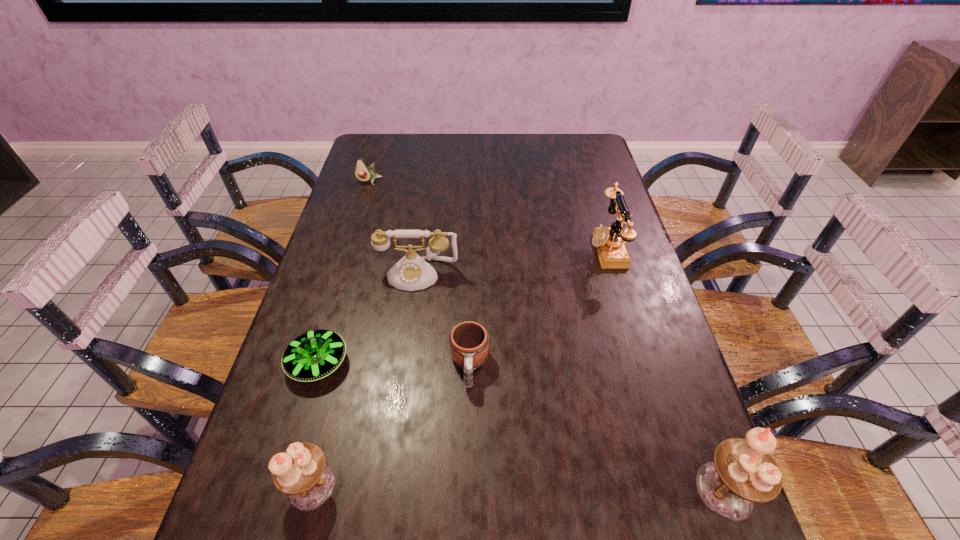
Locate an element on the screen. The height and width of the screenshot is (540, 960). saucer that is at the left edge is located at coordinates (315, 354).

The height and width of the screenshot is (540, 960). Find the location of `candle holder present at the right edge`. candle holder present at the right edge is located at coordinates (743, 472).

The image size is (960, 540). What are the coordinates of `telephone at the right edge` in the screenshot? It's located at (609, 241).

Find the location of a particular element. Image resolution: width=960 pixels, height=540 pixels. object located at the near left corner is located at coordinates click(x=301, y=472).

Image resolution: width=960 pixels, height=540 pixels. Identify the location of object that is at the near right corner. (743, 472).

The height and width of the screenshot is (540, 960). In the image, there is a desktop. Find the location of `vacant space at the far edge`. vacant space at the far edge is located at coordinates (439, 137).

Image resolution: width=960 pixels, height=540 pixels. What are the coordinates of `vacant space at the left edge of the desktop` in the screenshot? It's located at (389, 184).

Locate an element on the screen. The width and height of the screenshot is (960, 540). free space at the right edge of the desktop is located at coordinates (629, 423).

Where is `free space at the near left corner`? This screenshot has width=960, height=540. free space at the near left corner is located at coordinates (248, 461).

This screenshot has height=540, width=960. I want to click on free space between the saucer and the mug, so click(x=394, y=364).